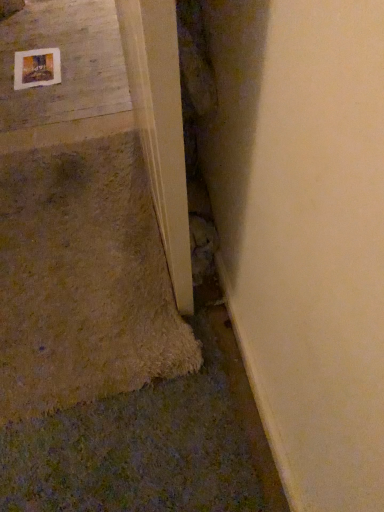
Question: Could you tell me if light wood door frame at lower left is facing wooden frame at upper left?

Choices:
 (A) yes
 (B) no

Answer: (B)

Question: From the image's perspective, would you say light wood door frame at lower left is shown under wooden frame at upper left?

Choices:
 (A) yes
 (B) no

Answer: (A)

Question: Are light wood door frame at lower left and wooden frame at upper left far apart?

Choices:
 (A) yes
 (B) no

Answer: (A)

Question: Is light wood door frame at lower left to the left of wooden frame at upper left from the viewer's perspective?

Choices:
 (A) no
 (B) yes

Answer: (A)

Question: Is wooden frame at upper left inside light wood door frame at lower left?

Choices:
 (A) no
 (B) yes

Answer: (A)

Question: From a real-world perspective, is smooth concrete at upper left physically located above or below light wood door frame at lower left?

Choices:
 (A) below
 (B) above

Answer: (A)

Question: Considering their positions, is smooth concrete at upper left located in front of or behind light wood door frame at lower left?

Choices:
 (A) behind
 (B) front

Answer: (A)

Question: Is smooth concrete at upper left wider or thinner than light wood door frame at lower left?

Choices:
 (A) thin
 (B) wide

Answer: (B)

Question: Is smooth concrete at upper left bigger or smaller than light wood door frame at lower left?

Choices:
 (A) big
 (B) small

Answer: (B)

Question: Considering the positions of point (28, 87) and point (137, 125), is point (28, 87) closer or farther from the camera than point (137, 125)?

Choices:
 (A) farther
 (B) closer

Answer: (A)

Question: From a real-world perspective, is wooden frame at upper left physically located above or below light wood door frame at lower left?

Choices:
 (A) below
 (B) above

Answer: (A)

Question: From their relative heights in the image, would you say wooden frame at upper left is taller or shorter than light wood door frame at lower left?

Choices:
 (A) tall
 (B) short

Answer: (B)

Question: In the image, is wooden frame at upper left positioned in front of or behind light wood door frame at lower left?

Choices:
 (A) front
 (B) behind

Answer: (B)

Question: From the image's perspective, is wooden frame at upper left above or below smooth concrete at upper left?

Choices:
 (A) below
 (B) above

Answer: (A)

Question: From a real-world perspective, is wooden frame at upper left above or below smooth concrete at upper left?

Choices:
 (A) below
 (B) above

Answer: (B)